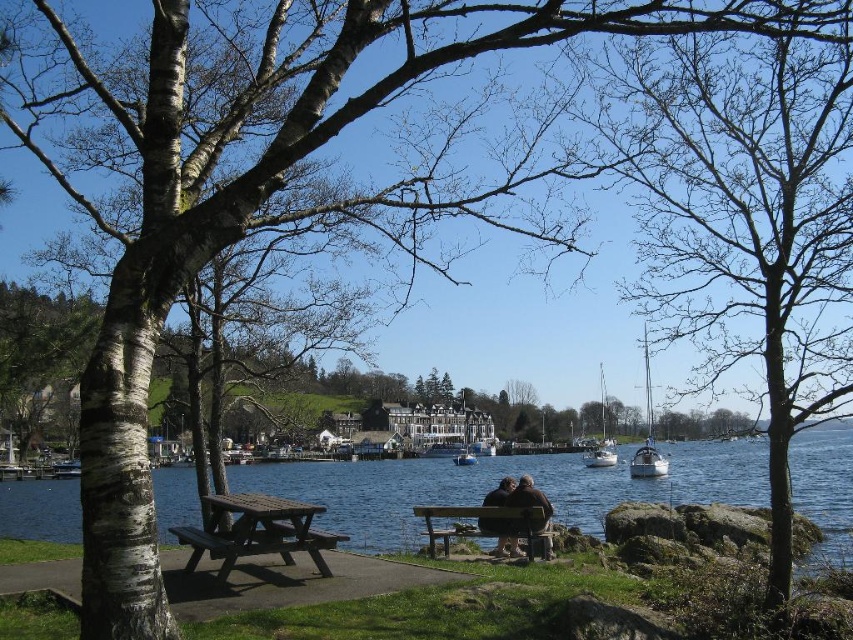
Question: Does brown leather bench at center appear on the right side of white glossy boat at center?

Choices:
 (A) no
 (B) yes

Answer: (A)

Question: Estimate the real-world distances between objects in this image. Which object is farther from the blue water at center?

Choices:
 (A) brown wooden picnic table at lower left
 (B) white glossy sailboat at right

Answer: (A)

Question: Which of these objects is positioned closest to the brown leather bench at center?

Choices:
 (A) brown wooden bench at center
 (B) white glossy sailboat at center-right

Answer: (A)

Question: Does brown wooden bench at center appear under white glossy sailboat at center-right?

Choices:
 (A) yes
 (B) no

Answer: (A)

Question: Which point is farther from the camera taking this photo?

Choices:
 (A) (494, 536)
 (B) (250, 529)

Answer: (A)

Question: Can you confirm if brown leather bench at center is wider than white glossy sailboat at right?

Choices:
 (A) yes
 (B) no

Answer: (B)